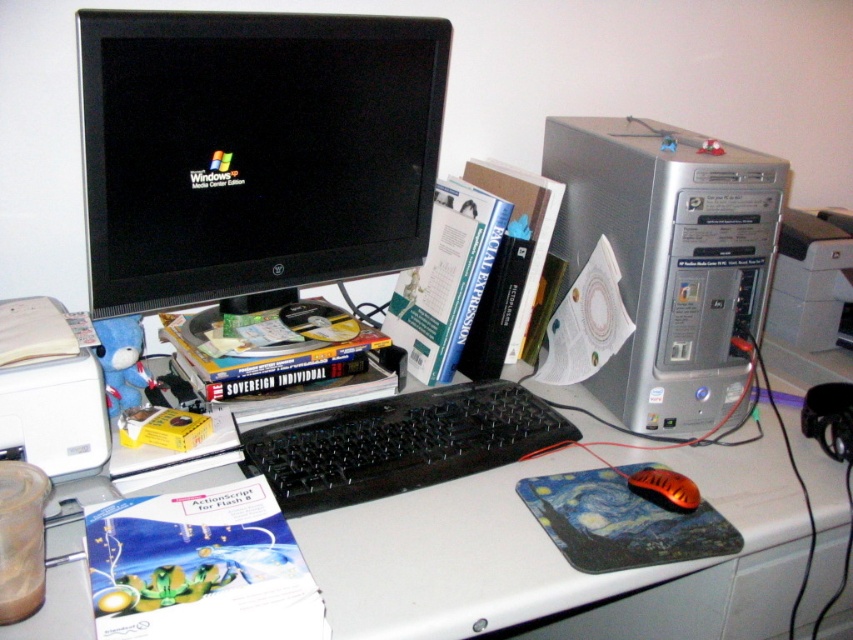
You are organizing your desk and want to place a new lamp between the silver metallic desktop pc at right and the silver metallic printer at right. Which side of the lamp should be closer to the taller object?

The silver metallic desktop pc at right is taller than the silver metallic printer at right, so the lamp should be placed closer to the silver metallic desktop pc at right to avoid blocking the view of the taller object.

You are standing in front of the desk and want to place a small object on the desk. There are two points marked on the desk where you can place it. The first point is at coordinates point [606,228] and the second point is at coordinates point [828,342]. Which point is closer to you?

Point [606,228] is closer to the camera than point [828,342], so the first point is closer to you.

You are setting up a new webcam for video calls. The webcam has a recommended placement area between coordinates 0.2 and 0.3 on the horizontal axis and between 0.25 and 0.35 on the vertical axis. Based on the scene description, can the black glossy monitor at upper left be placed within this recommended area for optimal webcam positioning?

The black glossy monitor at upper left is positioned at point (254, 150). This falls within the recommended horizontal range of 0.2 to 0.3 and the vertical range of 0.25 to 0.35, so yes, placing the black glossy monitor at upper left within this area would be optimal for the webcam positioning.